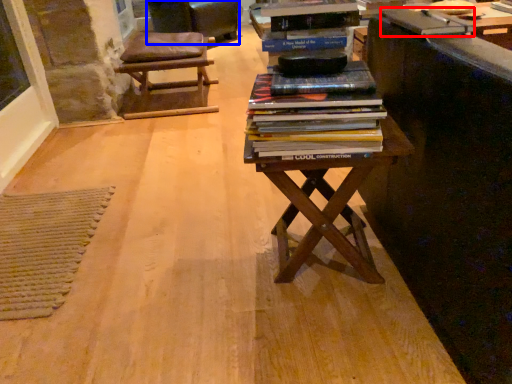
Question: Which object appears farthest to the camera in this image, paperback book (highlighted by a red box) or rocking chair (highlighted by a blue box)?

Choices:
 (A) paperback book
 (B) rocking chair

Answer: (B)